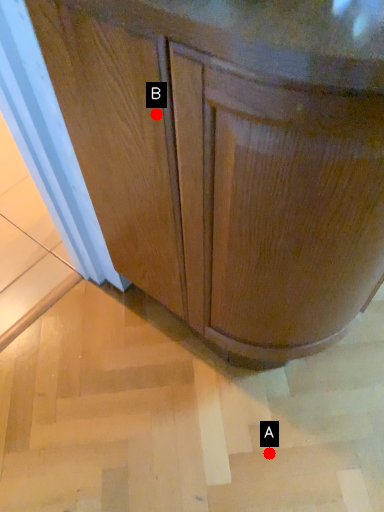
Question: Two points are circled on the image, labeled by A and B beside each circle. Which point is closer to the camera?

Choices:
 (A) A is closer
 (B) B is closer

Answer: (B)